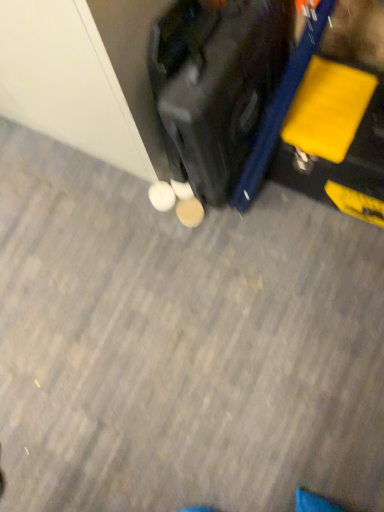
In order to face white matte shoe at center, which ranks as the 2th footwear in left-to-right order, should I rotate leftwards or rightwards?

Turn left approximately 0.281 degrees to face it.

Find the location of a particular element. This screenshot has width=384, height=512. shiny black suitcase at center is located at coordinates (215, 86).

Considering the positions of objects white matte shoe at center, which ranks as the 2th footwear in left-to-right order, and white matte shoe at center, which is the first footwear in left-to-right order, in the image provided, who is in front, white matte shoe at center, which ranks as the 2th footwear in left-to-right order, or white matte shoe at center, which is the first footwear in left-to-right order,?

white matte shoe at center, which ranks as the 2th footwear in left-to-right order.

Considering the positions of point (190, 205) and point (158, 203), is point (190, 205) closer or farther from the camera than point (158, 203)?

Point (190, 205) is closer to the camera than point (158, 203).

Locate an element on the screen. Image resolution: width=384 pixels, height=512 pixels. footwear on the left of the white matte shoe at center, which ranks as the 2th footwear in left-to-right order is located at coordinates (162, 196).

Considering the sizes of objects white matte shoe at center, which ranks as the 2th footwear in left-to-right order, and white matte shoe at center, which is the first footwear in left-to-right order, in the image provided, who is thinner, white matte shoe at center, which ranks as the 2th footwear in left-to-right order, or white matte shoe at center, which is the first footwear in left-to-right order,?

white matte shoe at center, which ranks as the 2th footwear in left-to-right order.

From a real-world perspective, is shiny black suitcase at center positioned under white matte shoe at center, which is the first footwear in left-to-right order, based on gravity?

No.

Can white matte shoe at center, positioned as the second footwear in right-to-left order, be found inside shiny black suitcase at center?

Actually, white matte shoe at center, positioned as the second footwear in right-to-left order, is outside shiny black suitcase at center.

What are the coordinates of `footwear that is the 1st object directly below the shiny black suitcase at center (from a real-world perspective)` in the screenshot? It's located at (162, 196).

Does point (256, 128) appear closer or farther from the camera than point (168, 195)?

Point (256, 128) is closer to the camera than point (168, 195).

Which object is closer to the camera, white matte shoe at center, which is the first footwear in left-to-right order, or white matte shoe at center, the 1th footwear from the right?

white matte shoe at center, the 1th footwear from the right.

Can you see white matte shoe at center, which is the first footwear in left-to-right order, touching white matte shoe at center, which ranks as the 2th footwear in left-to-right order?

Indeed, white matte shoe at center, which is the first footwear in left-to-right order, and white matte shoe at center, which ranks as the 2th footwear in left-to-right order, are beside each other and touching.

Does white matte shoe at center, positioned as the second footwear in right-to-left order, turn towards white matte shoe at center, the 1th footwear from the right?

No.

Which object is positioned more to the right, white matte shoe at center, which is the first footwear in left-to-right order, or white matte shoe at center, which ranks as the 2th footwear in left-to-right order?

white matte shoe at center, which ranks as the 2th footwear in left-to-right order.

In the scene shown: Which object is wider, white matte shoe at center, which ranks as the 2th footwear in left-to-right order, or shiny black suitcase at center?

shiny black suitcase at center.

From a real-world perspective, relative to shiny black suitcase at center, is white matte shoe at center, which ranks as the 2th footwear in left-to-right order, vertically above or below?

In terms of real-world spatial position, white matte shoe at center, which ranks as the 2th footwear in left-to-right order, is below shiny black suitcase at center.

Is white matte shoe at center, which ranks as the 2th footwear in left-to-right order, taller or shorter than shiny black suitcase at center?

Considering their sizes, white matte shoe at center, which ranks as the 2th footwear in left-to-right order, has less height than shiny black suitcase at center.

Consider the image. Measure the distance between shiny black suitcase at center and white matte shoe at center, which ranks as the 2th footwear in left-to-right order.

They are 12.58 inches apart.

Is shiny black suitcase at center far away from white matte shoe at center, which ranks as the 2th footwear in left-to-right order?

They are positioned close to each other.

Where is `footwear that is the 2nd one below the shiny black suitcase at center (from a real-world perspective)`? This screenshot has width=384, height=512. footwear that is the 2nd one below the shiny black suitcase at center (from a real-world perspective) is located at coordinates (190, 212).

Does shiny black suitcase at center have a greater width compared to white matte shoe at center, the 1th footwear from the right?

Indeed, shiny black suitcase at center has a greater width compared to white matte shoe at center, the 1th footwear from the right.

Can you confirm if white matte shoe at center, which is the first footwear in left-to-right order, is taller than shiny black suitcase at center?

No.

From a real-world perspective, relative to shiny black suitcase at center, is white matte shoe at center, positioned as the second footwear in right-to-left order, vertically above or below?

white matte shoe at center, positioned as the second footwear in right-to-left order, is situated lower than shiny black suitcase at center in the real world.

From the image's perspective, who appears lower, white matte shoe at center, positioned as the second footwear in right-to-left order, or shiny black suitcase at center?

white matte shoe at center, positioned as the second footwear in right-to-left order, from the image's perspective.

Does white matte shoe at center, positioned as the second footwear in right-to-left order, appear on the left side of shiny black suitcase at center?

Indeed, white matte shoe at center, positioned as the second footwear in right-to-left order, is positioned on the left side of shiny black suitcase at center.

Locate an element on the screen. This screenshot has width=384, height=512. footwear that is on the left side of white matte shoe at center, which ranks as the 2th footwear in left-to-right order is located at coordinates (162, 196).

The image size is (384, 512). I want to click on suitcase in front of the white matte shoe at center, positioned as the second footwear in right-to-left order, so click(x=215, y=86).

Which object lies further to the anchor point shiny black suitcase at center, white matte shoe at center, which ranks as the 2th footwear in left-to-right order, or white matte shoe at center, positioned as the second footwear in right-to-left order?

white matte shoe at center, positioned as the second footwear in right-to-left order.

Looking at the image, which one is located further to white matte shoe at center, which ranks as the 2th footwear in left-to-right order, white matte shoe at center, positioned as the second footwear in right-to-left order, or shiny black suitcase at center?

Among the two, shiny black suitcase at center is located further to white matte shoe at center, which ranks as the 2th footwear in left-to-right order.

From the image, which object appears to be farther from white matte shoe at center, which is the first footwear in left-to-right order, white matte shoe at center, the 1th footwear from the right, or shiny black suitcase at center?

The object further to white matte shoe at center, which is the first footwear in left-to-right order, is shiny black suitcase at center.

Considering their positions, is white matte shoe at center, positioned as the second footwear in right-to-left order, positioned further to shiny black suitcase at center than white matte shoe at center, which ranks as the 2th footwear in left-to-right order?

The object further to shiny black suitcase at center is white matte shoe at center, positioned as the second footwear in right-to-left order.

Estimate the real-world distances between objects in this image. Which object is further from white matte shoe at center, which is the first footwear in left-to-right order, shiny black suitcase at center or white matte shoe at center, the 1th footwear from the right?

Based on the image, shiny black suitcase at center appears to be further to white matte shoe at center, which is the first footwear in left-to-right order.

Considering their positions, is shiny black suitcase at center positioned further to white matte shoe at center, the 1th footwear from the right, than white matte shoe at center, positioned as the second footwear in right-to-left order?

Based on the image, shiny black suitcase at center appears to be further to white matte shoe at center, the 1th footwear from the right.

This screenshot has width=384, height=512. What are the coordinates of `footwear positioned between shiny black suitcase at center and white matte shoe at center, positioned as the second footwear in right-to-left order, from near to far` in the screenshot? It's located at (190, 212).